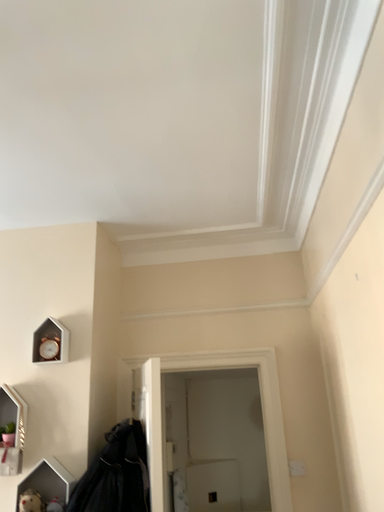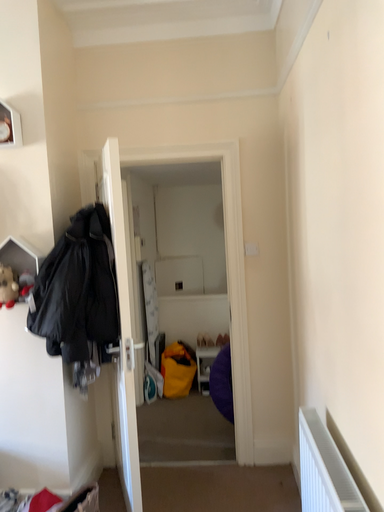
Question: Which way did the camera rotate in the video?

Choices:
 (A) rotated upward
 (B) rotated downward

Answer: (B)